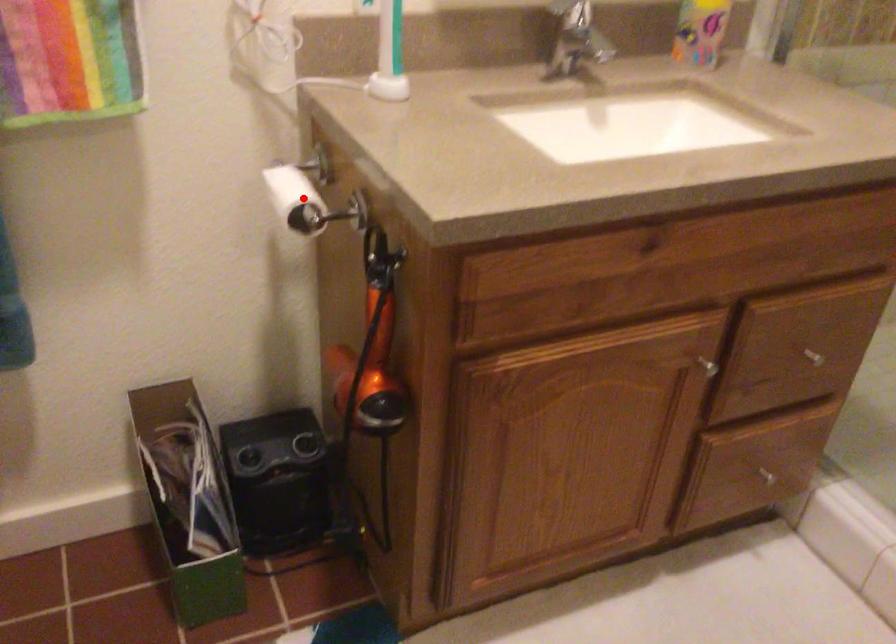
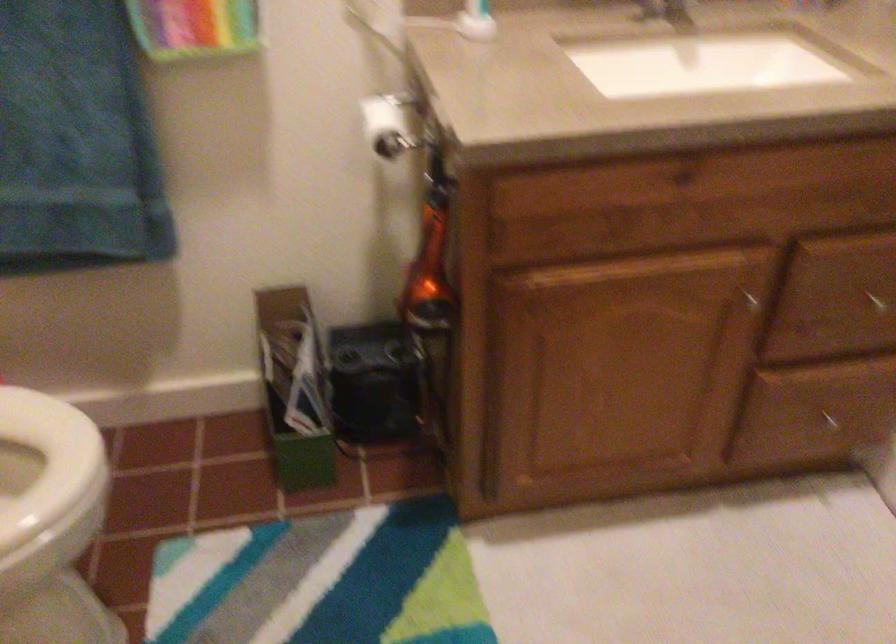
Question: I am providing you with two images of the same scene from different viewpoints. Image1 has a red point marked. In image2, the corresponding 3D location appears at what relative position? Reply with the corresponding letter.

Choices:
 (A) Closer
 (B) Farther

Answer: (B)